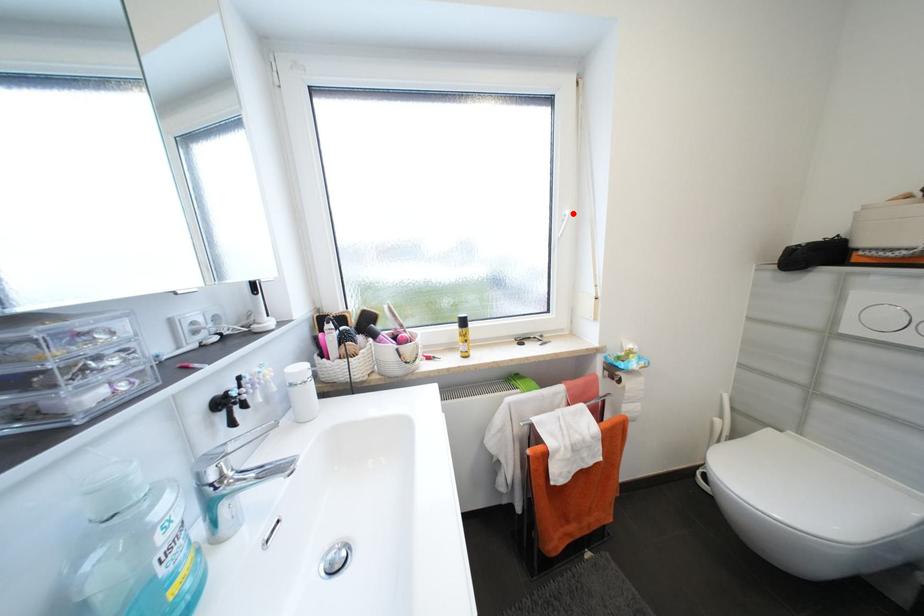
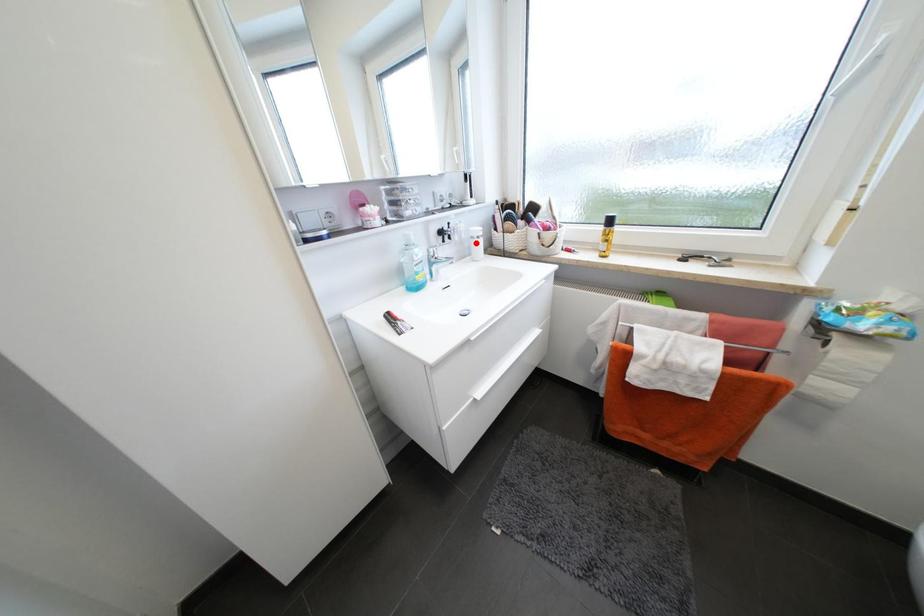
I am providing you with two images of the same scene from different viewpoints. A red point is marked on the first image and another point is marked on the second image. Is the red point in image1 aligned with the point shown in image2?

No